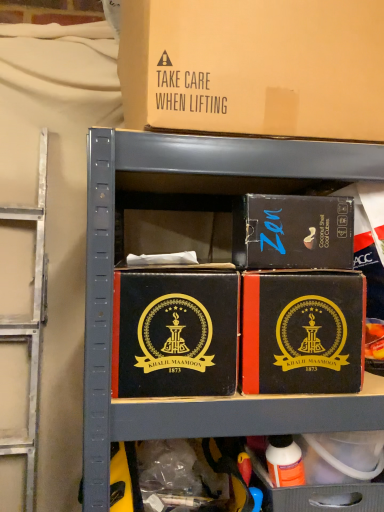
Question: Is black leather box at center, positioned as the third box in top-to-bottom order, a part of matte black box at upper right, arranged as the second box when viewed from the top?

Choices:
 (A) no
 (B) yes

Answer: (A)

Question: Considering the relative sizes of matte black box at upper right, arranged as the second box when viewed from the top, and black leather box at center, which is the 2th box from bottom to top, in the image provided, is matte black box at upper right, arranged as the second box when viewed from the top, bigger than black leather box at center, which is the 2th box from bottom to top,?

Choices:
 (A) no
 (B) yes

Answer: (A)

Question: Is matte black box at upper right, marked as the third box in a bottom-to-top arrangement, smaller than black leather box at center, positioned as the third box in top-to-bottom order?

Choices:
 (A) no
 (B) yes

Answer: (B)

Question: Can you confirm if matte black box at upper right, arranged as the second box when viewed from the top, is shorter than black leather box at center, which is the 2th box from bottom to top?

Choices:
 (A) yes
 (B) no

Answer: (A)

Question: From a real-world perspective, is matte black box at upper right, arranged as the second box when viewed from the top, over black leather box at center, which is the 2th box from bottom to top?

Choices:
 (A) yes
 (B) no

Answer: (A)

Question: Does matte black box at upper right, marked as the third box in a bottom-to-top arrangement, have a lesser width compared to black leather box at center, positioned as the third box in top-to-bottom order?

Choices:
 (A) yes
 (B) no

Answer: (A)

Question: From a real-world perspective, is brown cardboard box at upper center, which appears as the first box when viewed from the top, located higher than black leather box at center, which is the 2th box from bottom to top?

Choices:
 (A) no
 (B) yes

Answer: (B)

Question: Is brown cardboard box at upper center, which appears as the first box when viewed from the top, wider than black leather box at center, which is the 2th box from bottom to top?

Choices:
 (A) yes
 (B) no

Answer: (B)

Question: From the image's perspective, does brown cardboard box at upper center, which is the fourth box in bottom-to-top order, appear lower than black leather box at center, which is the 2th box from bottom to top?

Choices:
 (A) yes
 (B) no

Answer: (B)

Question: Is black leather box at center, which is the 2th box from bottom to top, surrounded by brown cardboard box at upper center, which appears as the first box when viewed from the top?

Choices:
 (A) no
 (B) yes

Answer: (A)

Question: Is brown cardboard box at upper center, which is the fourth box in bottom-to-top order, with black leather box at center, positioned as the third box in top-to-bottom order?

Choices:
 (A) yes
 (B) no

Answer: (B)

Question: Is brown cardboard box at upper center, which appears as the first box when viewed from the top, taller than black leather box at center, which is the 2th box from bottom to top?

Choices:
 (A) yes
 (B) no

Answer: (A)

Question: Considering the relative positions of matte black box at center, placed as the fourth box when sorted from top to bottom, and brown cardboard box at upper center, which appears as the first box when viewed from the top, in the image provided, is matte black box at center, placed as the fourth box when sorted from top to bottom, to the left of brown cardboard box at upper center, which appears as the first box when viewed from the top, from the viewer's perspective?

Choices:
 (A) no
 (B) yes

Answer: (A)